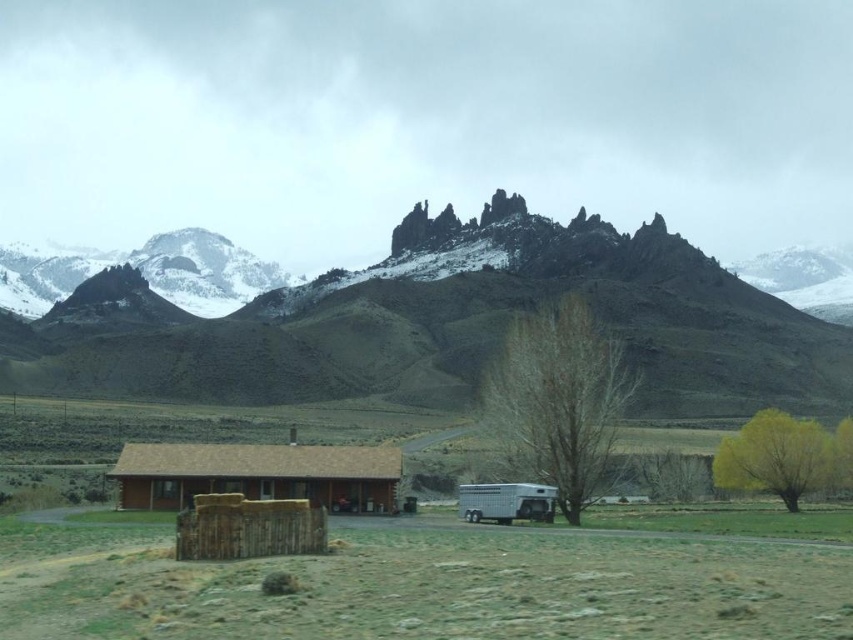
You are standing in the field near the brown log cabin at center and want to take a photo of the yellow leafy tree at lower right. To get a clear view, should you move towards the cabin or away from it?

Since the brown log cabin at center is in front of the yellow leafy tree at lower right, moving away from the cabin will give you a clearer view of the tree.

You are planning to transport a large sculpture that is 10 meters tall. You need to decide whether to place it on the rugged rock formation at center or the white glossy horse trailer at lower right. Based on their sizes, which location can accommodate the sculpture?

The rugged rock formation at center is larger in size than the white glossy horse trailer at lower right, so the sculpture should be placed on the rugged rock formation at center as it can accommodate the larger size.

You are a hiker who wants to measure the distance between the two trees in the image. You have a measuring tape that can extend up to 25 meters. Can you measure the distance between the bare wood tree at center and the yellow leafy tree at lower right using your tape?

The distance between the bare wood tree at center and the yellow leafy tree at lower right is 23.81 meters, which is within the 25 meters limit of your measuring tape. Yes, you can measure the distance between them using your tape.